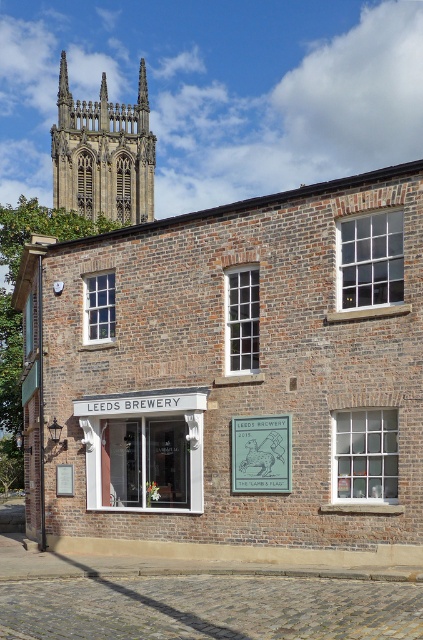
In order to click on dark brown stone tower at upper left in this screenshot , I will do `click(104, 154)`.

Is dark brown stone tower at upper left wider than green metal sign at center?

Correct, the width of dark brown stone tower at upper left exceeds that of green metal sign at center.

Which is behind, point (147, 216) or point (274, 480)?

Point (147, 216)

You are a GUI agent. You are given a task and a screenshot of the screen. Output one action in this format:
    pyautogui.click(x=<x>, y=<y>)
    Task: Click on the dark brown stone tower at upper left
    
    Given the screenshot: What is the action you would take?
    pyautogui.click(x=104, y=154)

Is point (183, 493) closer to viewer compared to point (57, 152)?

Yes, it is.

Is the position of white wooden signboard at center more distant than that of dark brown stone tower at upper left?

No, it is not.

Is point (131, 483) farther from camera compared to point (82, 112)?

No.

Identify the location of white wooden signboard at center. (143, 449).

In the scene shown: Can you confirm if white wooden signboard at center is bigger than green metal sign at center?

Indeed, white wooden signboard at center has a larger size compared to green metal sign at center.

Is white wooden signboard at center to the left of green metal sign at center from the viewer's perspective?

Indeed, white wooden signboard at center is positioned on the left side of green metal sign at center.

Does point (120, 451) come farther from viewer compared to point (277, 456)?

That is True.

Find the location of a particular element. The image size is (423, 640). white wooden signboard at center is located at coordinates (143, 449).